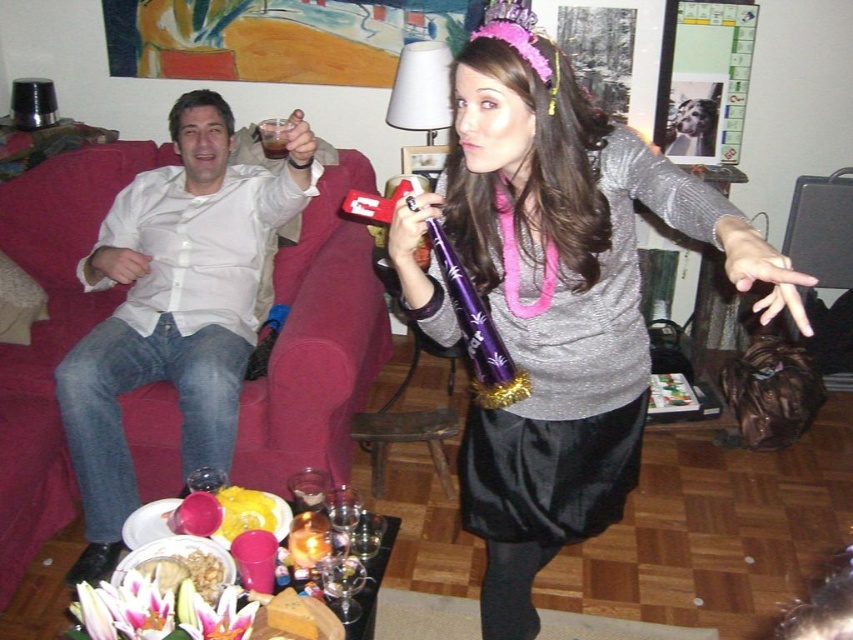
Question: Can you confirm if white button-down shirt at center is positioned above satin black dress at center?

Choices:
 (A) no
 (B) yes

Answer: (B)

Question: Which of these objects is positioned farthest from the satin black dress at center?

Choices:
 (A) white button-down shirt at center
 (B) brown liquid at couch left

Answer: (A)

Question: Which point is closer to the camera?

Choices:
 (A) white button-down shirt at center
 (B) brown liquid at couch left

Answer: (A)

Question: Does white button-down shirt at center have a smaller size compared to brown liquid at couch left?

Choices:
 (A) no
 (B) yes

Answer: (A)

Question: Which is nearer to the brown liquid at couch left?

Choices:
 (A) satin black dress at center
 (B) white button-down shirt at center

Answer: (B)

Question: Is white button-down shirt at center positioned before brown liquid at couch left?

Choices:
 (A) no
 (B) yes

Answer: (B)